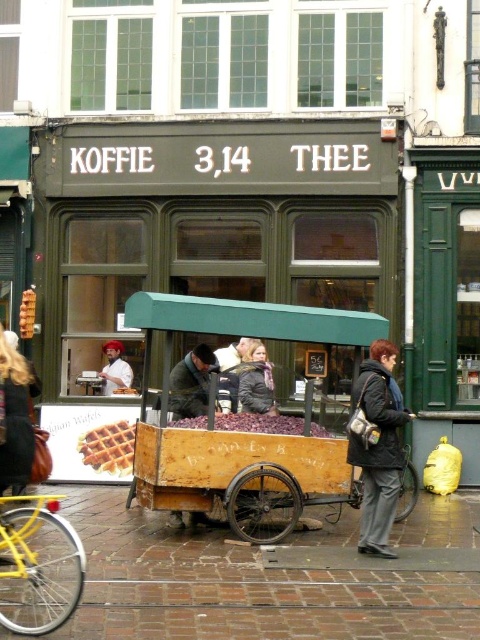
Question: Among these objects, which one is nearest to the camera?

Choices:
 (A) brown wooden cart at center
 (B) golden waffle at center
 (C) wooden cart at center
 (D) dark gray jacket at center

Answer: (C)

Question: Can you confirm if golden waffle at center is bigger than brown wooden cart at center?

Choices:
 (A) yes
 (B) no

Answer: (B)

Question: Among these objects, which one is nearest to the camera?

Choices:
 (A) waffletexturedfood at center
 (B) wooden cart at center
 (C) brick pavement at lower center

Answer: (C)

Question: Is yellow matte bicycle at lower left wider than brown wooden cart at center?

Choices:
 (A) yes
 (B) no

Answer: (B)

Question: Is dark gray fabric jacket at lower right positioned in front of brown wooden cart at center?

Choices:
 (A) no
 (B) yes

Answer: (B)

Question: Which object is the closest to the brown wooden cart at center?

Choices:
 (A) golden waffle at center
 (B) dark gray fabric jacket at lower right
 (C) brick pavement at lower center
 (D) wooden cart at center

Answer: (D)